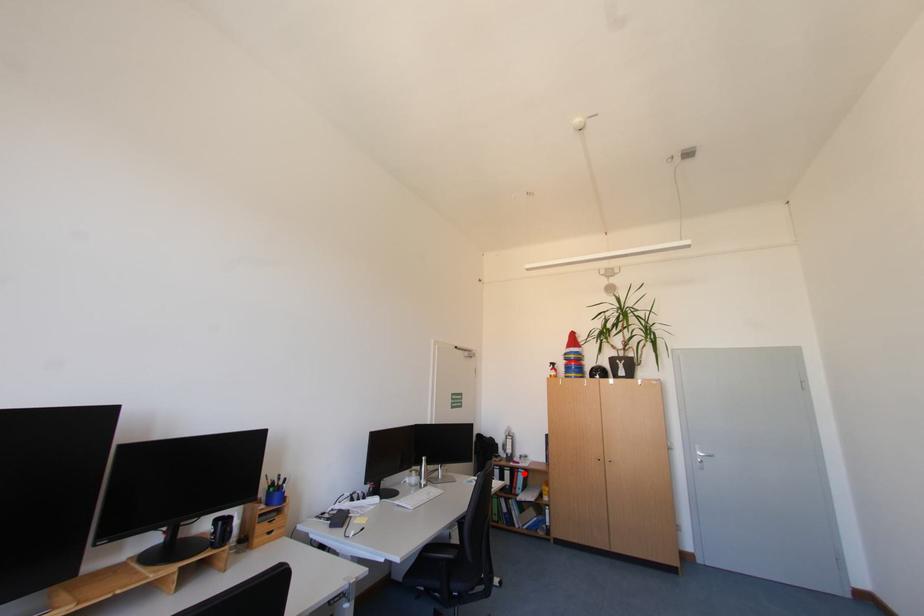
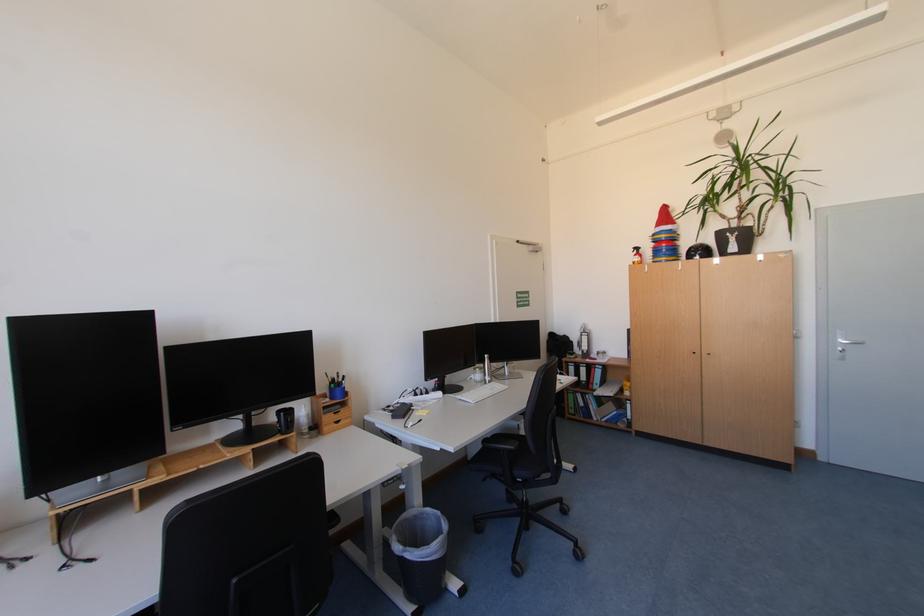
Question: I am providing you with two images of the same scene from different viewpoints. A red point is marked on the first image. Can you still see the location of the red point in image 2?

Choices:
 (A) Yes
 (B) No

Answer: (A)